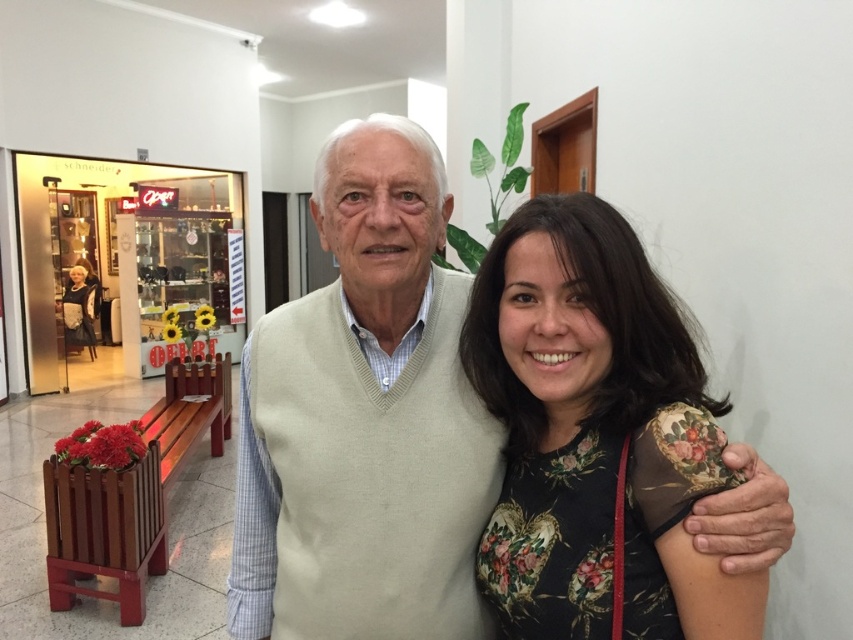
Can you confirm if light beige sweater at center is shorter than black textured coat at left?

Indeed, light beige sweater at center has a lesser height compared to black textured coat at left.

Is point (405, 300) farther from viewer compared to point (77, 320)?

No, it is not.

Locate an element on the screen. light beige sweater at center is located at coordinates (372, 426).

What do you see at coordinates (585, 420) in the screenshot? Image resolution: width=853 pixels, height=640 pixels. I see `floral fabric dress at center` at bounding box center [585, 420].

Image resolution: width=853 pixels, height=640 pixels. What do you see at coordinates (585, 420) in the screenshot? I see `floral fabric dress at center` at bounding box center [585, 420].

Image resolution: width=853 pixels, height=640 pixels. I want to click on floral fabric dress at center, so click(x=585, y=420).

Does light beige sweater at center have a smaller size compared to floral fabric dress at center?

No.

Which is above, light beige sweater at center or floral fabric dress at center?

floral fabric dress at center is higher up.

Locate an element on the screen. This screenshot has height=640, width=853. light beige sweater at center is located at coordinates (372, 426).